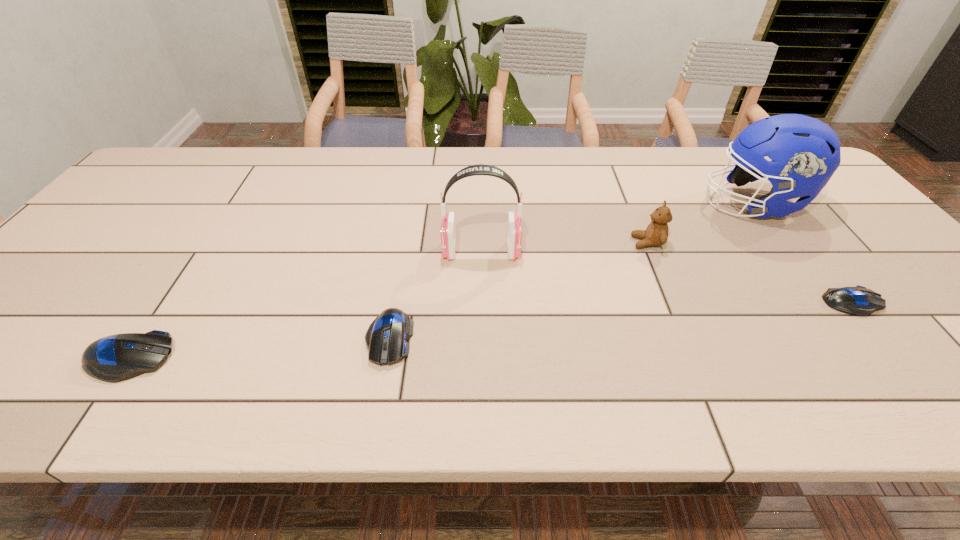
Where is `blank region between the farthest object and the leftmost computer mouse`? The width and height of the screenshot is (960, 540). blank region between the farthest object and the leftmost computer mouse is located at coordinates (441, 281).

The height and width of the screenshot is (540, 960). I want to click on vacant space that's between the football helmet and the leftmost computer mouse, so click(441, 281).

This screenshot has width=960, height=540. Identify the location of blank region between the shortest object and the farthest object. 802,253.

Where is `vacant area that lies between the fifth object from right to left and the football helmet`? The image size is (960, 540). vacant area that lies between the fifth object from right to left and the football helmet is located at coordinates pos(570,271).

Locate an element on the screen. This screenshot has height=540, width=960. unoccupied position between the leftmost object and the farthest object is located at coordinates (441, 281).

Where is `vacant area that lies between the second shortest object and the third object from left to right`? Image resolution: width=960 pixels, height=540 pixels. vacant area that lies between the second shortest object and the third object from left to right is located at coordinates (435, 295).

At what (x,y) coordinates should I click in order to perform the action: click on empty space between the farthest object and the leftmost computer mouse. Please return your answer as a coordinate pair (x, y). Looking at the image, I should click on (441, 281).

Locate an element on the screen. The image size is (960, 540). object that is the third closest to the earphone is located at coordinates (805, 152).

The width and height of the screenshot is (960, 540). What are the coordinates of `object that can be found as the fifth closest to the earphone` in the screenshot? It's located at (860, 301).

Find the location of `computer mouse that is the second closest one to the second shortest object`. computer mouse that is the second closest one to the second shortest object is located at coordinates (860, 301).